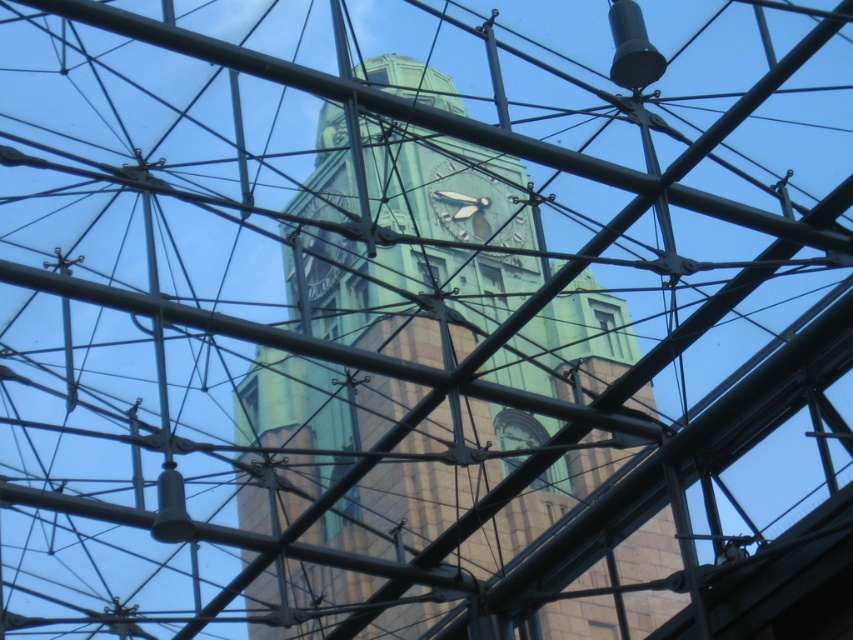
Does green metallic clock tower at center come behind green stone clock at center?

No, it is not.

Between point (503, 422) and point (491, 225), which one is positioned behind?

Point (491, 225)

Find the location of a particular element. green metallic clock tower at center is located at coordinates (399, 248).